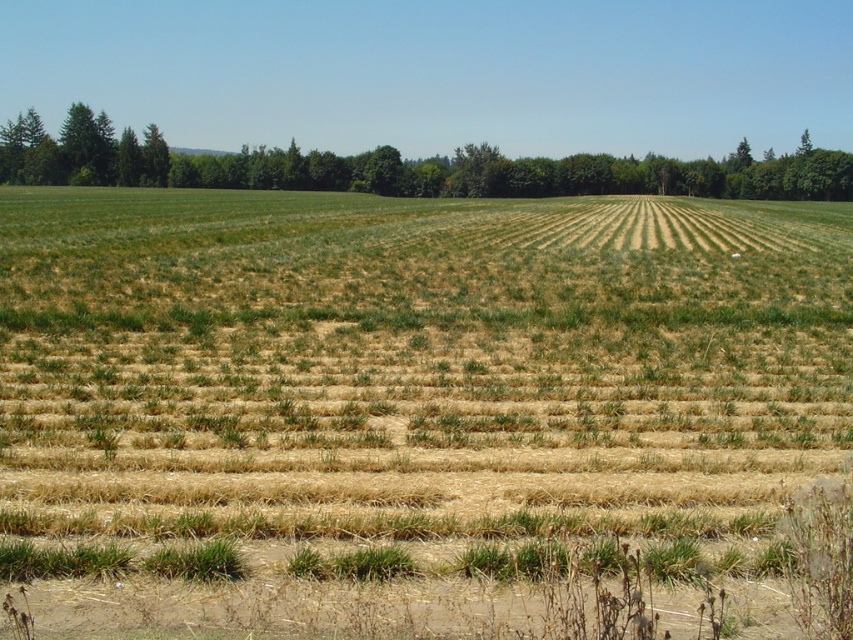
Question: In this image, where is green grass at center located relative to green leafy tree at upper left?

Choices:
 (A) left
 (B) right

Answer: (B)

Question: Is the position of green grass at center less distant than that of green leafy tree at upper left?

Choices:
 (A) yes
 (B) no

Answer: (A)

Question: Which object appears farthest from the camera in this image?

Choices:
 (A) green grass at center
 (B) green leafy tree at upper left

Answer: (B)

Question: Which of the following is the farthest from the observer?

Choices:
 (A) (560, 168)
 (B) (300, 381)

Answer: (A)

Question: Is green grass at center positioned at the back of green leafy tree at upper left?

Choices:
 (A) no
 (B) yes

Answer: (A)

Question: Which point is farther to the camera?

Choices:
 (A) green grass at center
 (B) green leafy tree at upper left

Answer: (B)